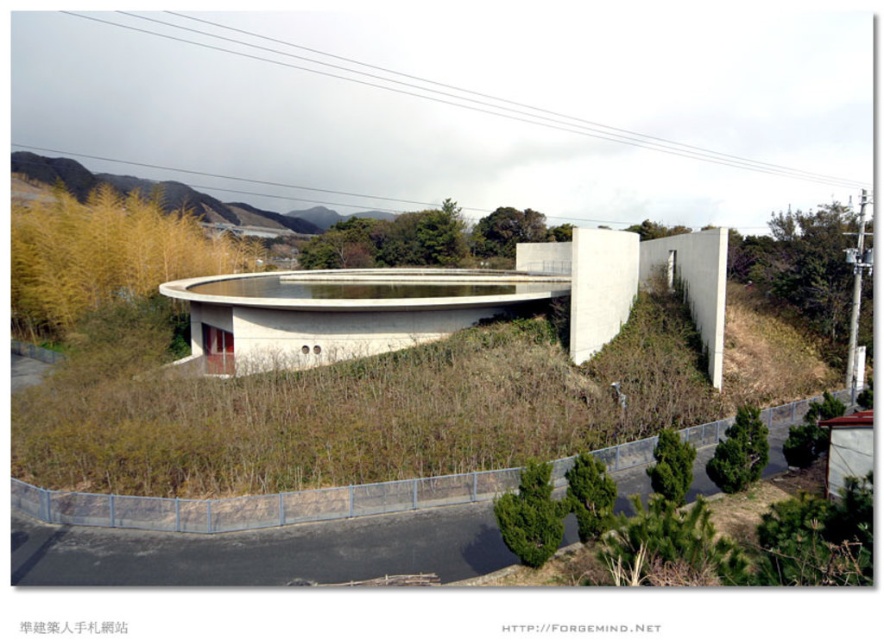
You are standing at the entrance of the modern architectural structure. You see a point marked at coordinates (x=397, y=406). Based on the scene description, what type of surface is located at that point?

The point at coordinates (x=397, y=406) is on green matte grass at center.

You are a landscape architect reviewing the design of this modern building. You notice the green matte grass at center and the yellow grass at upper left. Which area should you prioritize for maintenance to prevent soil erosion, and why?

The yellow grass at upper left should be prioritized for maintenance because it is located above the green matte grass at center, making it more susceptible to erosion from water runoff flowing downward.

You are a landscape architect designing a garden for this building. You need to place a 5m wide sculpture between the green matte grass at center and the smooth concrete overpass at center. Which area can accommodate the sculpture based on their widths?

The green matte grass at center has a greater width than the smooth concrete overpass at center, so the sculpture can be placed on the green matte grass at center as it is wider and can accommodate the 5m width.